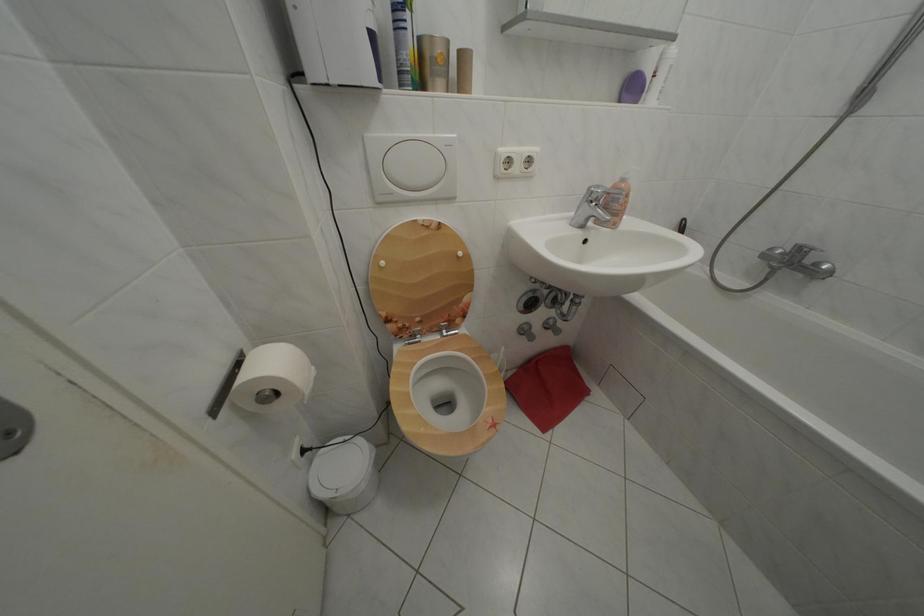
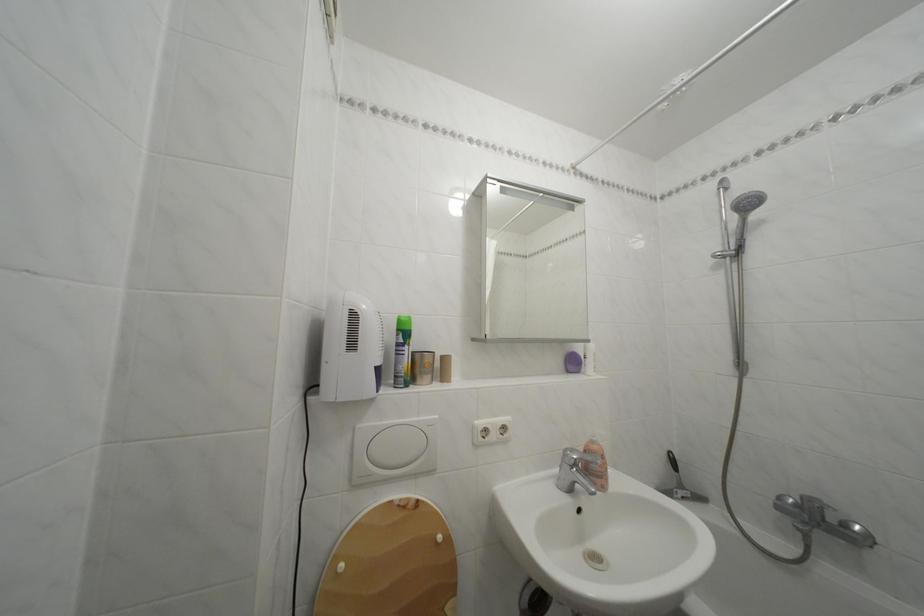
The point at (375, 142) is marked in the first image. Where is the corresponding point in the second image?

(368, 432)